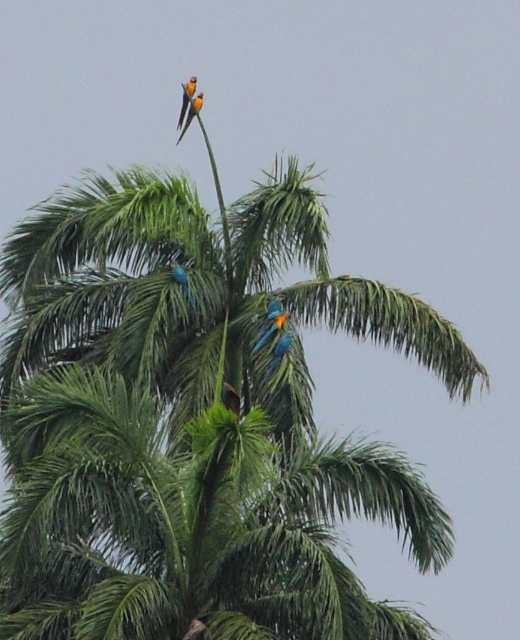
Is blue glossy parrot at center thinner than blue-green feathers at top?

Incorrect, blue glossy parrot at center's width is not less than blue-green feathers at top's.

Does blue glossy parrot at center appear under blue-green feathers at top?

Yes, blue glossy parrot at center is below blue-green feathers at top.

Between point (187, 300) and point (191, 116), which one is positioned behind?

The point (191, 116) is behind.

Locate an element on the screen. This screenshot has height=640, width=520. blue glossy parrot at center is located at coordinates (182, 282).

Between point (282, 323) and point (178, 122), which one is positioned behind?

The point (178, 122) is more distant.

Is shiny blue parrot at center above blue-green feathers at top?

Actually, shiny blue parrot at center is below blue-green feathers at top.

Where is `shiny blue parrot at center`? shiny blue parrot at center is located at coordinates (271, 321).

In order to click on shiny blue parrot at center in this screenshot , I will do `click(271, 321)`.

Is green leafy coconut tree at upper center bigger than blue glossy parrot at center?

Correct, green leafy coconut tree at upper center is larger in size than blue glossy parrot at center.

Looking at this image, can you confirm if green leafy coconut tree at upper center is smaller than blue glossy parrot at center?

Actually, green leafy coconut tree at upper center might be larger than blue glossy parrot at center.

Does point (71, 385) come behind point (167, 260)?

No.

You are a GUI agent. You are given a task and a screenshot of the screen. Output one action in this format:
    pyautogui.click(x=<x>, y=<y>)
    Task: Click on the green leafy coconut tree at upper center
    This screenshot has width=520, height=640.
    Given the screenshot: What is the action you would take?
    pyautogui.click(x=190, y=417)